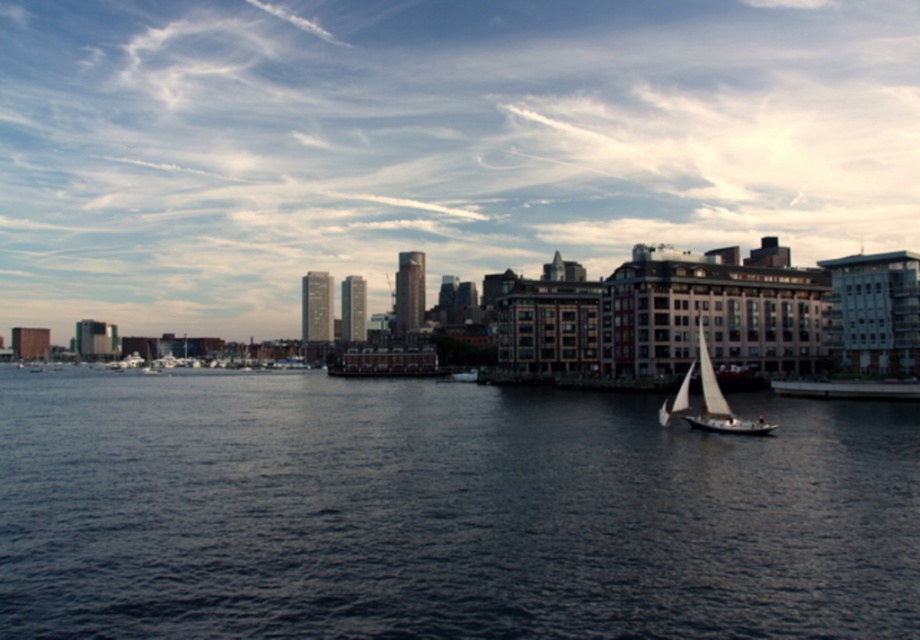
You are navigating a small boat and need to avoid a specific area. According to the image, where is the dark blue water at center located?

The dark blue water at center is located at point (443, 513).

You are an observer standing on the dock and see the dark blue water at center and the white sailboat at lower right. Which object takes up more space in the image?

The dark blue water at center takes up more space in the image than the white sailboat at lower right because it is bigger.